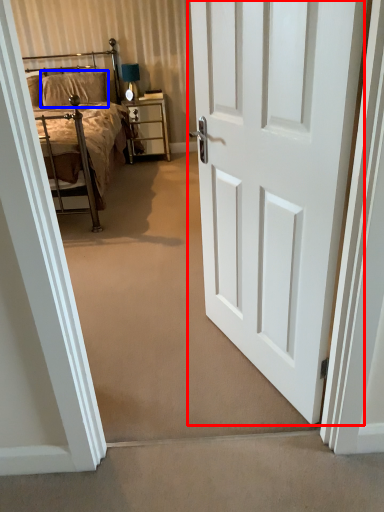
Question: Which object is closer to the camera taking this photo, door (highlighted by a red box) or pillow (highlighted by a blue box)?

Choices:
 (A) door
 (B) pillow

Answer: (A)